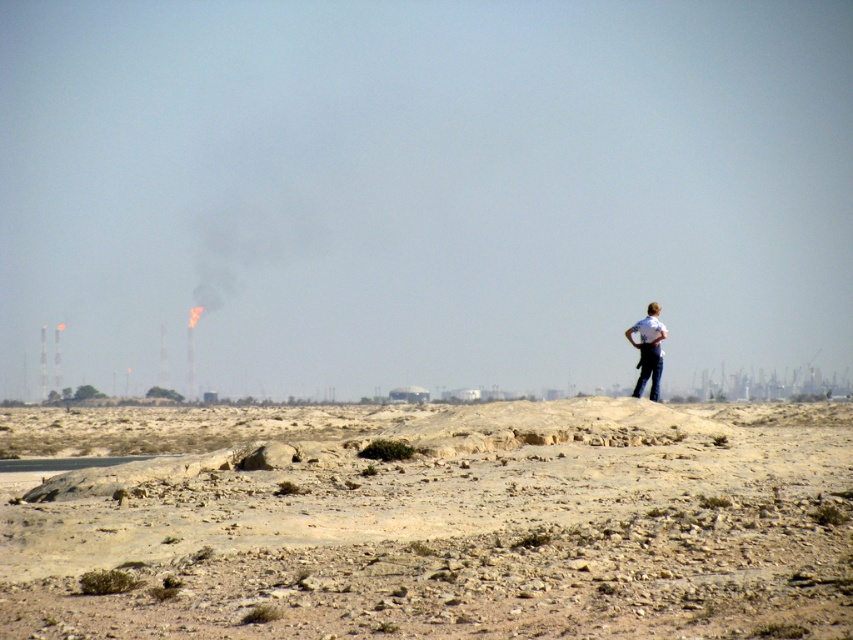
You are navigating a drone over an arid landscape. Your mission is to locate the dull brown dirt at center. Given the coordinates provided, can you confirm if the point at [440,522] is the correct location for the dull brown dirt at center?

Yes, the point at [440,522] is the correct location for the dull brown dirt at center as indicated by the coordinates provided.

You are a photographer trying to capture the white shirt at upper right without the dull brown dirt at center blocking it. Based on their positions, is this possible?

The dull brown dirt at center is in front of the white shirt at upper right, so it will block the view of the white shirt at upper right. You cannot capture the white shirt at upper right without the dull brown dirt at center blocking it.

You are a hiker trying to navigate through the rugged terrain. You notice the dull brown dirt at center and the white shirt at upper right. Which object is higher in elevation?

The dull brown dirt at center is much taller than the white shirt at upper right, so the dull brown dirt at center is higher in elevation.